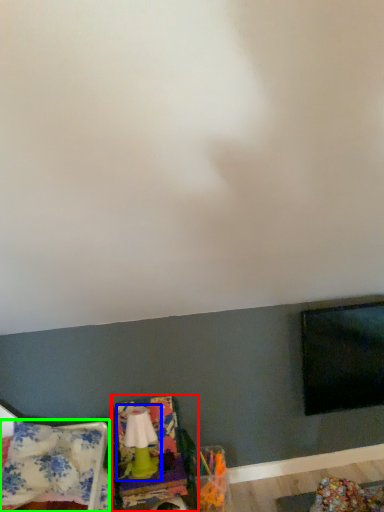
Question: Estimate the real-world distances between objects in this image. Which object is closer to swivel chair (highlighted by a red box), lamp (highlighted by a blue box) or blanket (highlighted by a green box)?

Choices:
 (A) lamp
 (B) blanket

Answer: (A)